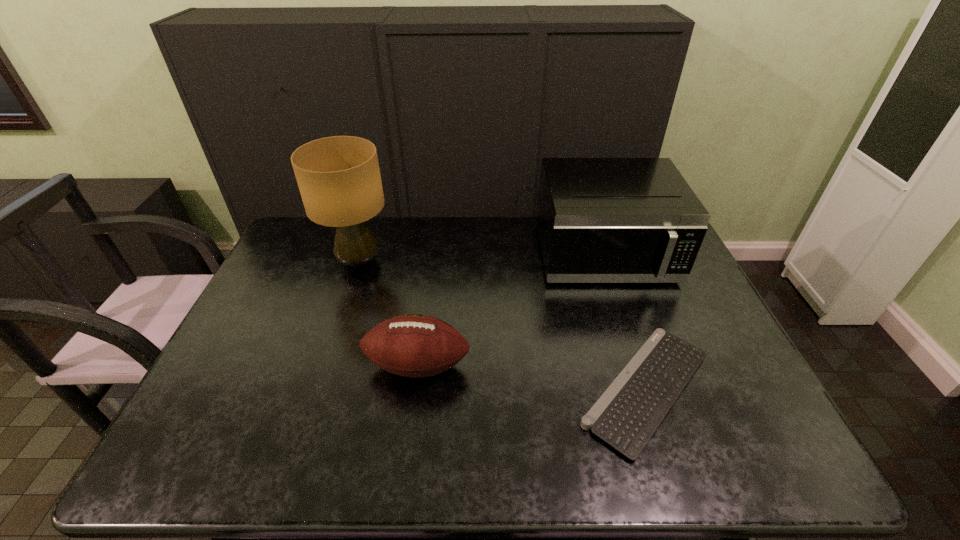
I want to click on object at the near edge, so click(x=628, y=413).

Where is `microwave_oven that is positioned at the right edge`? microwave_oven that is positioned at the right edge is located at coordinates (600, 220).

Where is `computer keyboard located in the right edge section of the desktop`? Image resolution: width=960 pixels, height=540 pixels. computer keyboard located in the right edge section of the desktop is located at coordinates (628, 413).

Locate an element on the screen. object that is at the far right corner is located at coordinates (600, 220).

Locate an element on the screen. object present at the near right corner is located at coordinates (628, 413).

Locate an element on the screen. This screenshot has height=540, width=960. free space at the far edge of the desktop is located at coordinates (331, 246).

In the image, there is a desktop. What are the coordinates of `vacant space at the near edge` in the screenshot? It's located at (512, 449).

The width and height of the screenshot is (960, 540). What are the coordinates of `vacant space at the left edge` in the screenshot? It's located at (271, 320).

In the image, there is a desktop. Identify the location of free space at the right edge. The width and height of the screenshot is (960, 540). (689, 338).

In order to click on vacant space that is in between the second shortest object and the tallest object in this screenshot , I will do point(388,314).